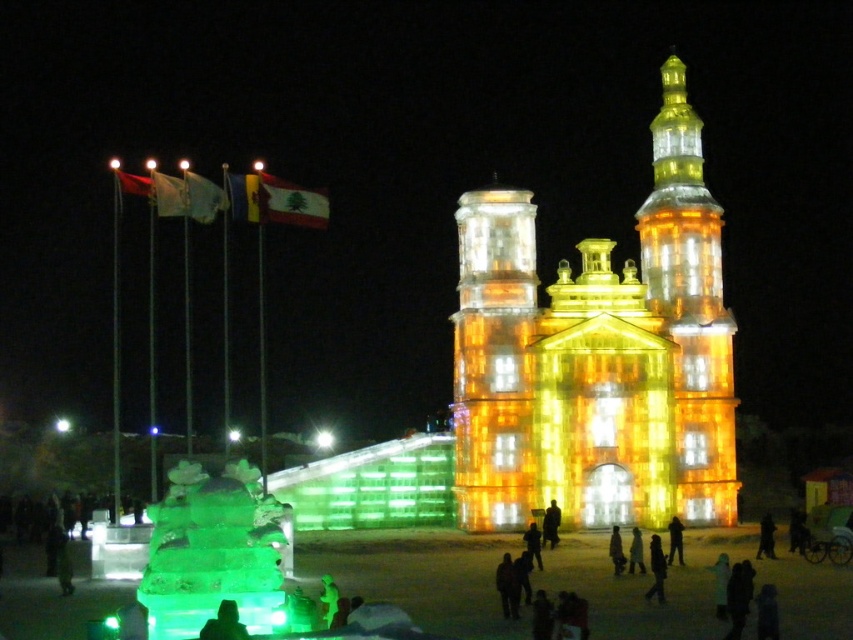
You are an architect evaluating the ice cathedral design. You notice the illuminated glass tower at upper right and the illuminated ice tower at center. Which tower has a larger base width according to the design specifications?

The illuminated glass tower at upper right might be wider than the illuminated ice tower at center according to the design specifications.

You are a photographer standing in front of the nighttime ice cathedral scene. You want to capture a photo that includes both the illuminated ice sculpture at center and the illuminated ice tower at center. Based on their positions, which one should you adjust your camera angle to focus on first to ensure both are in the frame?

The illuminated ice sculpture at center is located above the illuminated ice tower at center, so you should adjust your camera angle to focus on the illuminated ice tower at center first, as it is lower and ensure both are visible in the frame.

You are standing in front of the nighttime ice sculpture display. You see the illuminated ice sculpture at center and the illuminated glass tower at upper right. Which object is positioned higher up in the image?

The illuminated glass tower at upper right is positioned higher up in the image than the illuminated ice sculpture at center.